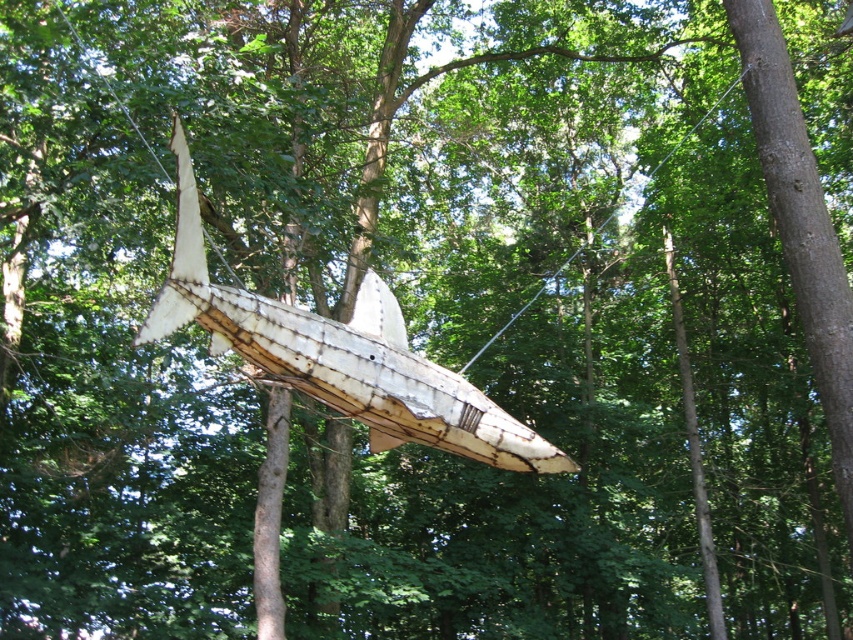
You are a park ranger who needs to secure the rusty wood boat at center to the clear wire at center using a rope. What is the minimum length of rope you need to connect them?

The minimum length of rope needed is 15.28 meters, as that is the distance between the rusty wood boat at center and the clear wire at center.

You are an artist planning to install a new sculpture in the forest. You have a small wooden bench that needs to be placed near the rusty wood boat at center and the clear wire at center. To ensure stability, the bench should be placed closer to the larger object. Which object should you place the bench next to?

The clear wire at center is larger than the rusty wood boat at center, so you should place the bench next to the clear wire at center for stability.

You are standing in a forest near an art installation. You see a rusty wood boat at center. Can you walk up to it without moving through the dense foliage? Explain your reasoning.

The rusty wood boat at center is 5.81 meters away from the viewer. Since the path to it is clear of dense foliage as per the scene description, you can walk up to it without needing to move through the dense foliage.